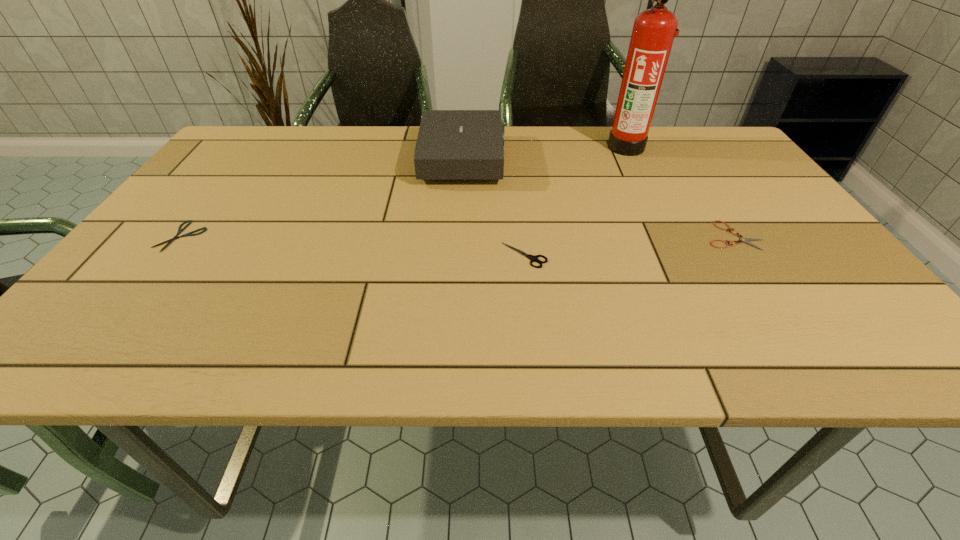
You are a GUI agent. You are given a task and a screenshot of the screen. Output one action in this format:
    pyautogui.click(x=<x>, y=<y>)
    Task: Click on the free region located on the front-facing side of the projector
    Image resolution: width=960 pixels, height=540 pixels.
    Given the screenshot: What is the action you would take?
    click(581, 160)

This screenshot has width=960, height=540. Identify the location of vacant position located 0.050m on the right of the second shears from right to left. (570, 255).

Find the location of a particular element. This screenshot has width=960, height=540. free spot located on the back of the rightmost shears is located at coordinates (698, 184).

Where is `free space located on the right of the leftmost object`? free space located on the right of the leftmost object is located at coordinates (366, 237).

Identify the location of fire extinguisher located at the far edge. This screenshot has width=960, height=540. (654, 29).

Locate an element on the screen. The height and width of the screenshot is (540, 960). projector that is at the far edge is located at coordinates (452, 144).

I want to click on object present at the left edge, so click(180, 230).

Where is `object present at the right edge`? object present at the right edge is located at coordinates (746, 240).

I want to click on blank space at the far edge, so click(x=407, y=165).

Find the location of `free space at the near edge of the desktop`. free space at the near edge of the desktop is located at coordinates (693, 323).